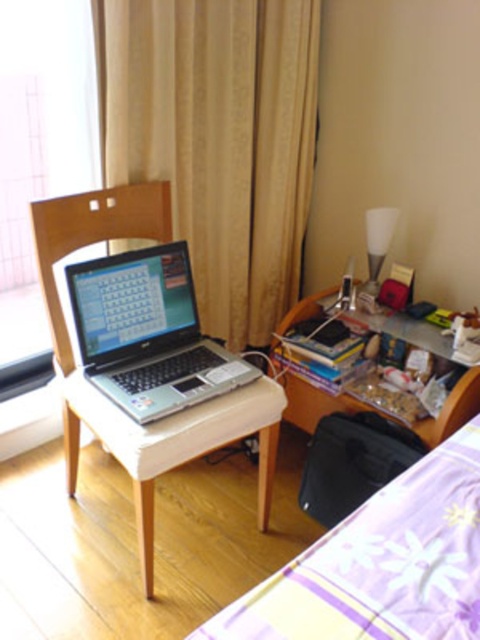
Question: Observing the image, what is the correct spatial positioning of beige fabric curtain at upper center in reference to silver/black laptop at left?

Choices:
 (A) below
 (B) above

Answer: (B)

Question: Can you confirm if wooden chair at center is wider than silver/black laptop at left?

Choices:
 (A) no
 (B) yes

Answer: (B)

Question: Which of the following is the farthest from the observer?

Choices:
 (A) silver/black laptop at left
 (B) wooden chair at center
 (C) wooden desk at right

Answer: (C)

Question: Is beige fabric curtain at upper center thinner than silver/black laptop at left?

Choices:
 (A) no
 (B) yes

Answer: (A)

Question: Estimate the real-world distances between objects in this image. Which object is farther from the wooden chair at center?

Choices:
 (A) silver/black laptop at left
 (B) wooden desk at right
 (C) transparent glass window at left

Answer: (B)

Question: Based on their relative distances, which object is nearer to the beige fabric curtain at upper center?

Choices:
 (A) wooden desk at right
 (B) wooden chair at center
 (C) silver/black laptop at left
 (D) transparent glass window at left

Answer: (D)